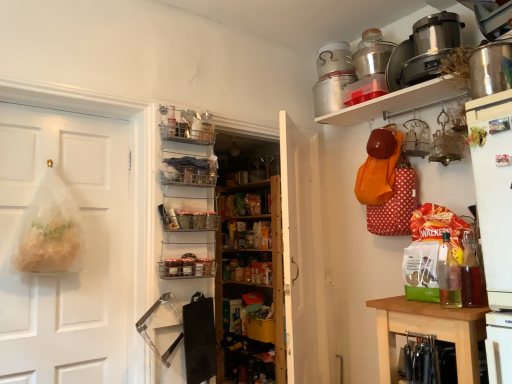
I want to click on metallic silver pot at upper right, positioned as the 1th appliance in top-to-bottom order, so click(x=334, y=60).

This screenshot has height=384, width=512. What do you see at coordinates (490, 69) in the screenshot?
I see `shiny metallic pot at upper right, the 4th appliance positioned from the top` at bounding box center [490, 69].

This screenshot has height=384, width=512. What do you see at coordinates (302, 255) in the screenshot? I see `white wood door at center, the second door from the left` at bounding box center [302, 255].

Identify the location of metallic wire basket at center, which is the second shelf from top to bottom. (186, 267).

The height and width of the screenshot is (384, 512). Describe the element at coordinates (186, 267) in the screenshot. I see `metallic wire basket at center, the first shelf ordered from the bottom` at that location.

Measure the distance between stainless steel food processor at upper right, positioned as the 3th appliance in front-to-back order, and camera.

stainless steel food processor at upper right, positioned as the 3th appliance in front-to-back order, is 2.02 meters from camera.

What do you see at coordinates (431, 46) in the screenshot? The height and width of the screenshot is (384, 512). I see `stainless steel food processor at upper right, the third appliance in the back-to-front sequence` at bounding box center [431, 46].

Describe the element at coordinates (448, 275) in the screenshot. I see `clear glass bottle at lower right, acting as the second bottle starting from the right` at that location.

Find the location of a particular element. The width and height of the screenshot is (512, 384). clear glass bottle at lower right, acting as the second bottle starting from the right is located at coordinates (448, 275).

Where is `metallic silver pot at upper right, the 5th appliance viewed from the front`? This screenshot has height=384, width=512. metallic silver pot at upper right, the 5th appliance viewed from the front is located at coordinates (334, 60).

Does point (475, 273) appear closer or farther from the camera than point (498, 329)?

Point (475, 273) appears to be farther away from the viewer than point (498, 329).

From a real-world perspective, is translucent glass bottle at right, acting as the 1th bottle starting from the right, physically located above or below white matte refrigerator at right, positioned as the 5th appliance in top-to-bottom order?

translucent glass bottle at right, acting as the 1th bottle starting from the right, is below white matte refrigerator at right, positioned as the 5th appliance in top-to-bottom order.

Does translucent glass bottle at right, arranged as the 2th bottle when viewed from the left, turn towards white matte refrigerator at right, positioned as the 5th appliance in top-to-bottom order?

No, translucent glass bottle at right, arranged as the 2th bottle when viewed from the left, is not aimed at white matte refrigerator at right, positioned as the 5th appliance in top-to-bottom order.

From the image's perspective, is translucent glass bottle at right, acting as the 1th bottle starting from the right, above white matte refrigerator at right, the first appliance positioned from the bottom?

No, from the image's perspective, translucent glass bottle at right, acting as the 1th bottle starting from the right, is not over white matte refrigerator at right, the first appliance positioned from the bottom.

From a real-world perspective, who is located lower, stainless steel food processor at upper right, the third appliance in the back-to-front sequence, or wooden bookshelf at center?

wooden bookshelf at center, from a real-world perspective.

Could you tell me if stainless steel food processor at upper right, positioned as the 3th appliance in front-to-back order, is facing wooden bookshelf at center?

No, stainless steel food processor at upper right, positioned as the 3th appliance in front-to-back order, is not oriented towards wooden bookshelf at center.

Is stainless steel food processor at upper right, the third appliance in the back-to-front sequence, at the left side of wooden bookshelf at center?

No.

Between point (444, 32) and point (261, 256), which one is positioned behind?

The point (261, 256) is more distant.

Is wooden bookshelf at center shorter than metallic wire baskets at center, which is counted as the first shelf, starting from the top?

No.

How much distance is there between wooden bookshelf at center and metallic wire baskets at center, the 2th shelf ordered from the bottom?

A distance of 3.45 feet exists between wooden bookshelf at center and metallic wire baskets at center, the 2th shelf ordered from the bottom.

Choose the correct answer: Is wooden bookshelf at center inside metallic wire baskets at center, which is counted as the first shelf, starting from the top, or outside it?

wooden bookshelf at center cannot be found inside metallic wire baskets at center, which is counted as the first shelf, starting from the top.

How distant is clear glass bottle at lower right, acting as the second bottle starting from the right, from metallic silver pot at upper right, positioned as the 1th appliance in top-to-bottom order?

clear glass bottle at lower right, acting as the second bottle starting from the right, and metallic silver pot at upper right, positioned as the 1th appliance in top-to-bottom order, are 4.55 feet apart.

In the scene shown: Between clear glass bottle at lower right, the 1th bottle in the left-to-right sequence, and metallic silver pot at upper right, the 5th appliance from the bottom, which one is positioned in front?

clear glass bottle at lower right, the 1th bottle in the left-to-right sequence, is in front.

Is clear glass bottle at lower right, acting as the second bottle starting from the right, far from metallic silver pot at upper right, the 5th appliance from the bottom?

Yes, clear glass bottle at lower right, acting as the second bottle starting from the right, and metallic silver pot at upper right, the 5th appliance from the bottom, are quite far apart.

Based on their sizes in the image, would you say clear glass bottle at lower right, the 1th bottle in the left-to-right sequence, is bigger or smaller than metallic silver pot at upper right, which appears as the first appliance when viewed from the back?

In the image, clear glass bottle at lower right, the 1th bottle in the left-to-right sequence, appears to be smaller than metallic silver pot at upper right, which appears as the first appliance when viewed from the back.

Measure the distance from stainless steel food processor at upper right, the second appliance positioned from the top, to green matte vegetable at upper right.

stainless steel food processor at upper right, the second appliance positioned from the top, and green matte vegetable at upper right are 27.73 inches apart.

Is stainless steel food processor at upper right, positioned as the 3th appliance in front-to-back order, in front of or behind green matte vegetable at upper right in the image?

stainless steel food processor at upper right, positioned as the 3th appliance in front-to-back order, is positioned farther from the viewer than green matte vegetable at upper right.

Can you confirm if stainless steel food processor at upper right, positioned as the 3th appliance in front-to-back order, is bigger than green matte vegetable at upper right?

Correct, stainless steel food processor at upper right, positioned as the 3th appliance in front-to-back order, is larger in size than green matte vegetable at upper right.

Is stainless steel food processor at upper right, positioned as the 3th appliance in front-to-back order, at the left side of green matte vegetable at upper right?

In fact, stainless steel food processor at upper right, positioned as the 3th appliance in front-to-back order, is to the right of green matte vegetable at upper right.

Considering the relative sizes of metallic silver pot at upper right, positioned as the 1th appliance in top-to-bottom order, and metallic silver pot at upper right, the fourth appliance when ordered from front to back, in the image provided, is metallic silver pot at upper right, positioned as the 1th appliance in top-to-bottom order, shorter than metallic silver pot at upper right, the fourth appliance when ordered from front to back,?

Yes, metallic silver pot at upper right, positioned as the 1th appliance in top-to-bottom order, is shorter than metallic silver pot at upper right, the fourth appliance when ordered from front to back.

Looking at this image, could you tell me if metallic silver pot at upper right, which appears as the first appliance when viewed from the back, is turned towards metallic silver pot at upper right, the 3th appliance from the top?

No, metallic silver pot at upper right, which appears as the first appliance when viewed from the back, is not facing towards metallic silver pot at upper right, the 3th appliance from the top.

You are a GUI agent. You are given a task and a screenshot of the screen. Output one action in this format:
    pyautogui.click(x=<x>, y=<y>)
    Task: Click on the appliance that is the 2nd object located below the metallic silver pot at upper right, which appears as the first appliance when viewed from the back (from the image's perspective)
    The height and width of the screenshot is (384, 512).
    Given the screenshot: What is the action you would take?
    pyautogui.click(x=372, y=53)

Is the depth of wooden bookshelf at center less than that of metallic silver pot at upper right, the 5th appliance from the bottom?

No, wooden bookshelf at center is further to the viewer.

Between wooden bookshelf at center and metallic silver pot at upper right, which appears as the first appliance when viewed from the back, which one appears on the right side from the viewer's perspective?

Positioned to the right is metallic silver pot at upper right, which appears as the first appliance when viewed from the back.

Considering the sizes of objects wooden bookshelf at center and metallic silver pot at upper right, the 5th appliance viewed from the front, in the image provided, who is bigger, wooden bookshelf at center or metallic silver pot at upper right, the 5th appliance viewed from the front,?

With larger size is wooden bookshelf at center.

From a real-world perspective, between wooden bookshelf at center and metallic silver pot at upper right, positioned as the 1th appliance in top-to-bottom order, who is vertically higher?

metallic silver pot at upper right, positioned as the 1th appliance in top-to-bottom order.

This screenshot has height=384, width=512. I want to click on the 2nd bottle below when counting from the white matte refrigerator at right, which appears as the fifth appliance when viewed from the back (from the image's perspective), so click(x=471, y=274).

This screenshot has height=384, width=512. In order to click on bookshelf lying behind the stainless steel food processor at upper right, the third appliance in the back-to-front sequence in this screenshot , I will do [x=250, y=282].

When comparing their distances from clear glass bottle at lower right, acting as the second bottle starting from the right, does translucent glass bottle at right, acting as the 1th bottle starting from the right, or metallic wire basket at center, which is the second shelf from top to bottom, seem further?

Among the two, metallic wire basket at center, which is the second shelf from top to bottom, is located further to clear glass bottle at lower right, acting as the second bottle starting from the right.

Estimate the real-world distances between objects in this image. Which object is closer to metallic silver pot at upper right, the fourth appliance when ordered from front to back, white matte refrigerator at right, the first appliance positioned from the bottom, or metallic wire baskets at center, which is counted as the first shelf, starting from the top?

The object closer to metallic silver pot at upper right, the fourth appliance when ordered from front to back, is white matte refrigerator at right, the first appliance positioned from the bottom.

Estimate the real-world distances between objects in this image. Which object is further from clear plastic bag at left, which ranks as the second door in right-to-left order, metallic wire baskets at center, the 2th shelf ordered from the bottom, or white matte refrigerator at right, the first appliance positioned from the front?

The object further to clear plastic bag at left, which ranks as the second door in right-to-left order, is white matte refrigerator at right, the first appliance positioned from the front.

Considering their positions, is green matte vegetable at upper right positioned further to translucent glass bottle at right, arranged as the 2th bottle when viewed from the left, than stainless steel food processor at upper right, the 4th appliance from the bottom?

stainless steel food processor at upper right, the 4th appliance from the bottom, lies further to translucent glass bottle at right, arranged as the 2th bottle when viewed from the left, than the other object.

Which object lies further to the anchor point green matte vegetable at upper right, clear plastic bag at left, which ranks as the second door in right-to-left order, or stainless steel food processor at upper right, positioned as the 3th appliance in front-to-back order?

The object further to green matte vegetable at upper right is clear plastic bag at left, which ranks as the second door in right-to-left order.

Based on the photo, from the image, which object appears to be farther from clear plastic bag at left, the first door in the left-to-right sequence, wooden bookshelf at center or metallic silver pot at upper right, the fourth appliance when ordered from front to back?

metallic silver pot at upper right, the fourth appliance when ordered from front to back, is positioned further to the anchor clear plastic bag at left, the first door in the left-to-right sequence.

Which object lies nearer to the anchor point green matte vegetable at upper right, metallic wire basket at center, which is the second shelf from top to bottom, or clear plastic bag at left, the first door in the left-to-right sequence?

metallic wire basket at center, which is the second shelf from top to bottom, is positioned closer to the anchor green matte vegetable at upper right.

Based on their spatial positions, is metallic silver pot at upper right, the fourth appliance when ordered from front to back, or metallic wire baskets at center, which is counted as the first shelf, starting from the top, further from wooden bookshelf at center?

Among the two, metallic silver pot at upper right, the fourth appliance when ordered from front to back, is located further to wooden bookshelf at center.

The height and width of the screenshot is (384, 512). I want to click on bookshelf located between clear plastic bag at left, the first door in the left-to-right sequence, and clear glass bottle at lower right, the 1th bottle in the left-to-right sequence, in the left-right direction, so (250, 282).

At what (x,y) coordinates should I click in order to perform the action: click on door located between clear plastic bag at left, the first door in the left-to-right sequence, and white matte refrigerator at right, the first appliance positioned from the bottom, in the left-right direction. Please return your answer as a coordinate pair (x, y). The height and width of the screenshot is (384, 512). Looking at the image, I should click on (302, 255).

At what (x,y) coordinates should I click in order to perform the action: click on food between white matte refrigerator at right, the first appliance positioned from the front, and wooden bookshelf at center, along the z-axis. Please return your answer as a coordinate pair (x, y). Looking at the image, I should click on (476, 136).

Identify the location of food between metallic silver pot at upper right, the 3th appliance in the bottom-to-top sequence, and wooden knife block at lower right in the up-down direction. (476, 136).